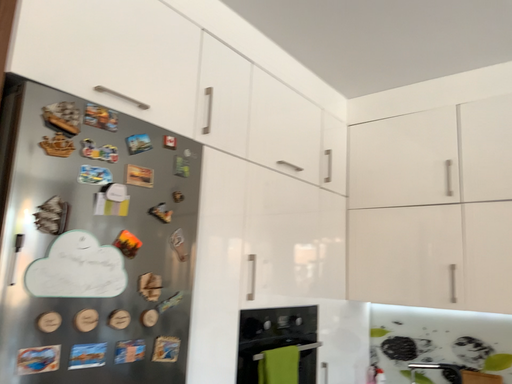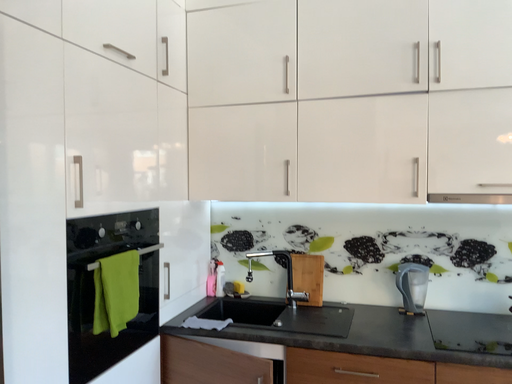
Question: How did the camera likely rotate when shooting the video?

Choices:
 (A) rotated left
 (B) rotated right

Answer: (B)